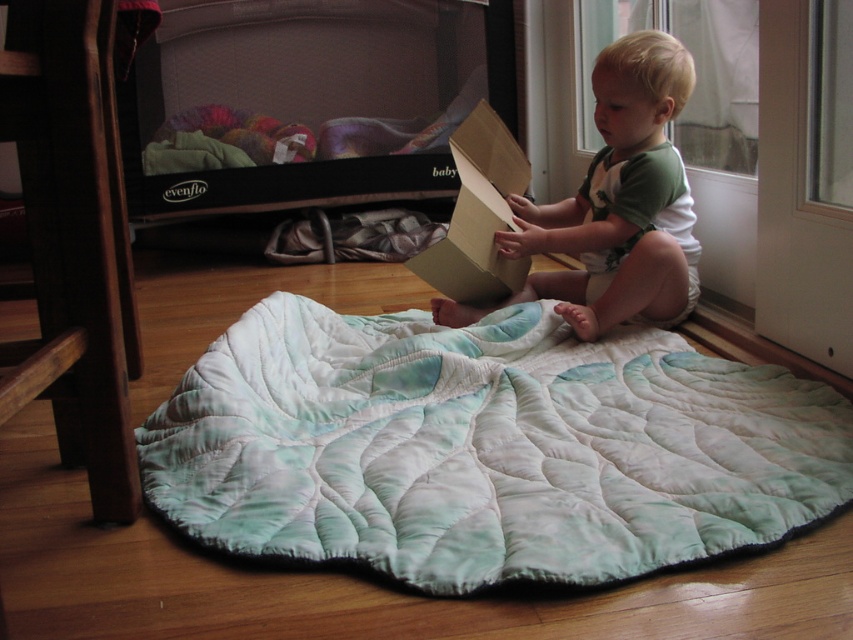
Which is in front, point (415, 451) or point (476, 147)?

Point (415, 451) is more forward.

Is point (785, 410) farther from viewer compared to point (450, 276)?

No, (785, 410) is in front of (450, 276).

Is point (444, 401) less distant than point (447, 268)?

That is True.

In order to click on mint quilted blanket at lower center in this screenshot , I will do `click(485, 448)`.

Between matte cardboard box at center and brown cardboard box at center, which one appears on the right side from the viewer's perspective?

Positioned to the right is matte cardboard box at center.

Between point (654, 289) and point (467, 301), which one is positioned behind?

The point (467, 301) is behind.

Where is `matte cardboard box at center`? Image resolution: width=853 pixels, height=640 pixels. matte cardboard box at center is located at coordinates (614, 204).

Who is positioned more to the left, mint quilted blanket at lower center or matte cardboard box at center?

mint quilted blanket at lower center

Can you confirm if mint quilted blanket at lower center is positioned to the right of matte cardboard box at center?

No, mint quilted blanket at lower center is not to the right of matte cardboard box at center.

Does point (434, 504) come in front of point (669, 252)?

That is True.

Where is `mint quilted blanket at lower center`? This screenshot has width=853, height=640. mint quilted blanket at lower center is located at coordinates (485, 448).